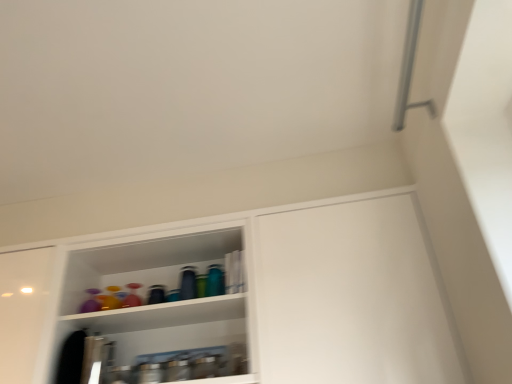
Describe the element at coordinates (261, 295) in the screenshot. This screenshot has width=512, height=384. I see `white glossy cabinet at upper center` at that location.

Where is `white glossy cabinet at upper center`? The width and height of the screenshot is (512, 384). white glossy cabinet at upper center is located at coordinates (261, 295).

Identify the location of white glossy cabinet at upper center. This screenshot has height=384, width=512. [261, 295].